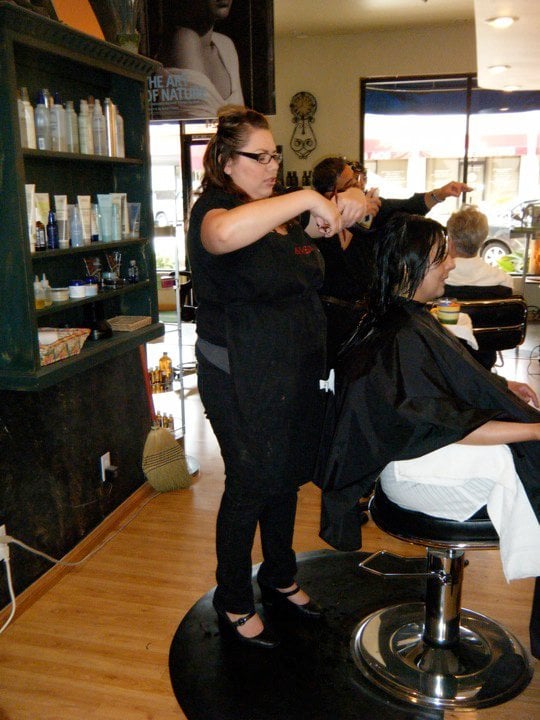
Identify the location of chair. This screenshot has height=720, width=540. (457, 525).